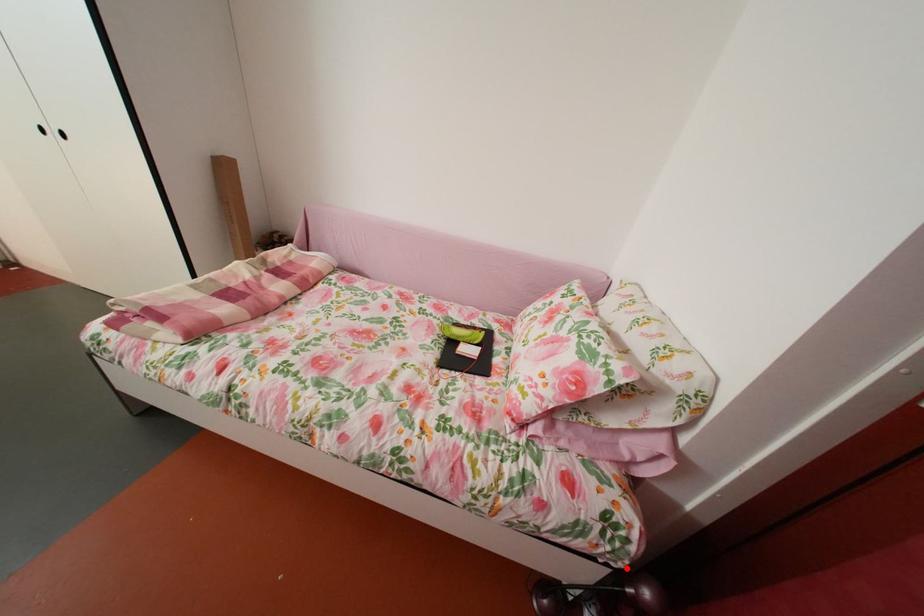
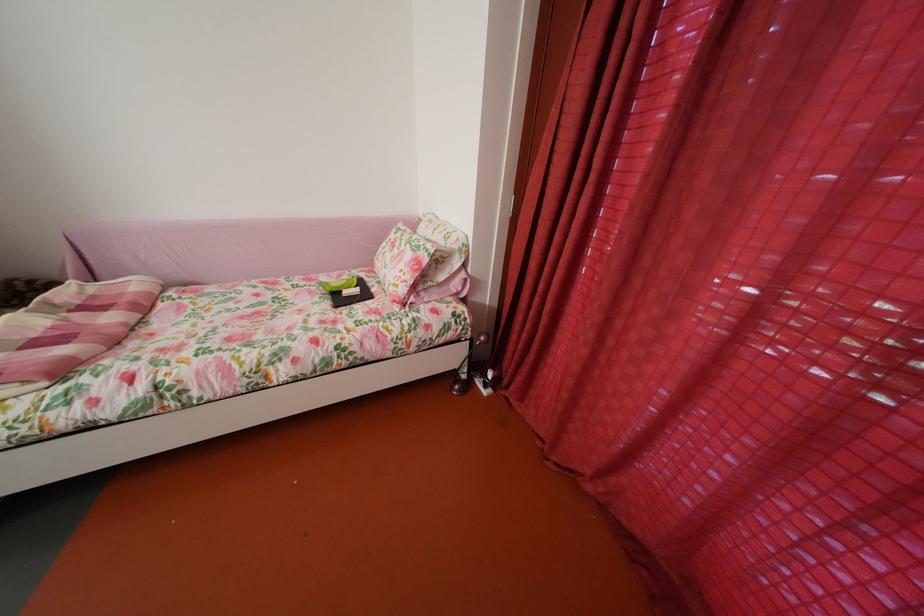
Locate, in the second image, the point that corresponds to the highlighted location in the first image.

(478, 339)